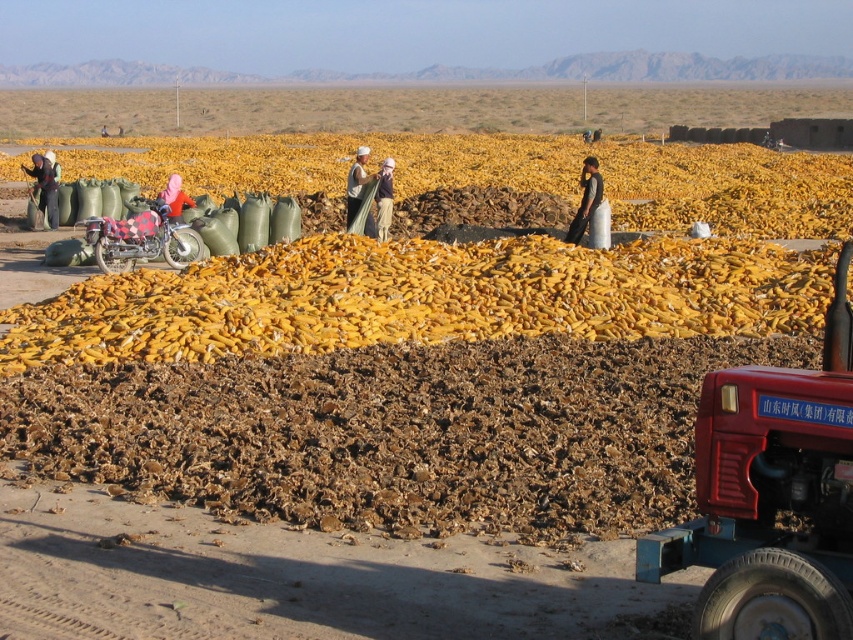
Question: Can you confirm if red metallic tractor at lower right is wider than matte white shirt at center?

Choices:
 (A) no
 (B) yes

Answer: (B)

Question: In this image, where is yellow matte corn at center located relative to light brown fabric at center?

Choices:
 (A) left
 (B) right

Answer: (B)

Question: In this image, where is black fabric at center located relative to dark gray fabric bag at left?

Choices:
 (A) above
 (B) below

Answer: (B)

Question: Which is farther from the matte white shirt at center?

Choices:
 (A) black fabric at center
 (B) red metallic tractor at lower right
 (C) yellow matte corn at center
 (D) dark gray fabric bag at left

Answer: (B)

Question: Which object is closer to the camera taking this photo?

Choices:
 (A) matte white shirt at center
 (B) pink fabric at center

Answer: (B)

Question: Which object is the farthest from the light brown fabric at center?

Choices:
 (A) dark gray fabric bag at left
 (B) pink fabric at center

Answer: (A)